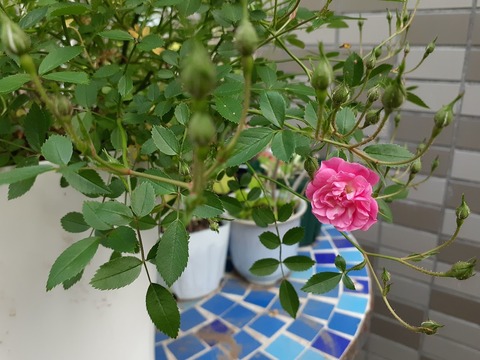
Where is `planter pot`? The height and width of the screenshot is (360, 480). planter pot is located at coordinates (197, 247), (249, 237), (23, 211), (305, 219).